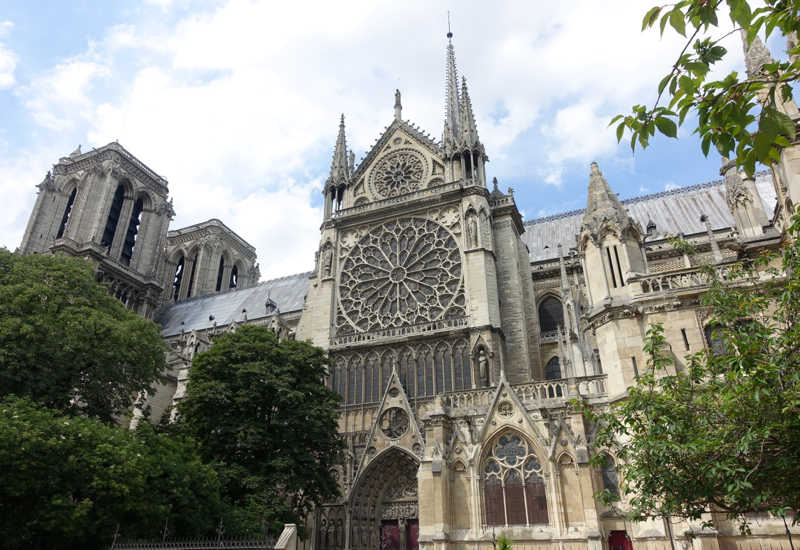
You are a GUI agent. You are given a task and a screenshot of the screen. Output one action in this format:
    pyautogui.click(x=<x>, y=<y>)
    Task: Click on the doors
    
    Given the screenshot: What is the action you would take?
    pyautogui.click(x=390, y=539), pyautogui.click(x=413, y=538)